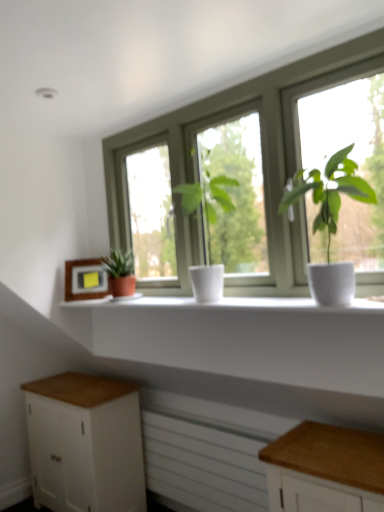
This screenshot has width=384, height=512. Describe the element at coordinates (85, 444) in the screenshot. I see `white wood cabinet at lower left` at that location.

Locate an element on the screen. The image size is (384, 512). white matte plant pot at center, the 3th houseplant from the left is located at coordinates (330, 221).

Image resolution: width=384 pixels, height=512 pixels. Find the location of `green matte plant at left, marked as the third houseplant in a right-to-left arrangement`. green matte plant at left, marked as the third houseplant in a right-to-left arrangement is located at coordinates point(120,273).

Is white matte window sill at center wider than white matte plant pot at center, positioned as the second houseplant in front-to-back order?

Yes.

Between white matte window sill at center and white matte plant pot at center, positioned as the second houseplant in left-to-right order, which one has larger size?

With larger size is white matte plant pot at center, positioned as the second houseplant in left-to-right order.

Which object is positioned more to the left, white matte window sill at center or white matte plant pot at center, positioned as the second houseplant in front-to-back order?

white matte window sill at center is more to the left.

From a real-world perspective, which object rests below the other?

white matte window sill at center is physically lower.

From the image's perspective, is white matte window at center over wooden frame at left?

Yes, from the image's perspective, white matte window at center is on top of wooden frame at left.

Based on the photo, which is less distant, (269, 162) or (89, 291)?

The point (269, 162) is in front.

The width and height of the screenshot is (384, 512). I want to click on picture frame behind the white matte window at center, so click(x=85, y=280).

From the picture: Which of these two, white matte window at center or wooden frame at left, stands shorter?

wooden frame at left is shorter.

Is point (133, 268) behind point (342, 275)?

Yes, point (133, 268) is farther from viewer.

Which is correct: green matte plant at left, which is counted as the third houseplant, starting from the front, is inside white matte plant pot at center, marked as the third houseplant in a back-to-front arrangement, or outside of it?

green matte plant at left, which is counted as the third houseplant, starting from the front, exists outside the volume of white matte plant pot at center, marked as the third houseplant in a back-to-front arrangement.

Based on the photo, are green matte plant at left, which is counted as the third houseplant, starting from the front, and white matte plant pot at center, the 1th houseplant positioned from the right, located far from each other?

Yes.

From the image's perspective, is green matte plant at left, the first houseplant positioned from the left, above or below white matte plant pot at center, which appears as the 1th houseplant when viewed from the front?

green matte plant at left, the first houseplant positioned from the left, is below white matte plant pot at center, which appears as the 1th houseplant when viewed from the front.

Locate an element on the screen. The height and width of the screenshot is (512, 384). the 1st houseplant in front of the white wood cabinet at lower left, starting your count from the anchor is located at coordinates (120, 273).

From a real-world perspective, is green matte plant at left, which is counted as the third houseplant, starting from the front, above or below white wood cabinet at lower left?

Clearly, from a real-world perspective, green matte plant at left, which is counted as the third houseplant, starting from the front, is above white wood cabinet at lower left.

Is white wood cabinet at lower left at the back of green matte plant at left, which is counted as the third houseplant, starting from the front?

No.

How distant is green matte plant at left, which is counted as the third houseplant, starting from the front, from white wood cabinet at lower left?

green matte plant at left, which is counted as the third houseplant, starting from the front, and white wood cabinet at lower left are 87.49 centimeters apart.

Does point (139, 510) lie in front of point (84, 268)?

No, it is behind (84, 268).

Can you confirm if white wood cabinet at lower left is positioned to the right of wooden frame at left?

No.

Image resolution: width=384 pixels, height=512 pixels. I want to click on cabinetry on the left of wooden frame at left, so click(85, 444).

Can you see white wood cabinet at lower left touching wooden frame at left?

No, white wood cabinet at lower left is not making contact with wooden frame at left.

From the image's perspective, which one is positioned higher, white matte plant pot at center, the 3th houseplant from the left, or white matte radiator at lower center?

white matte plant pot at center, the 3th houseplant from the left.

Looking at this image, which of these two, white matte plant pot at center, marked as the third houseplant in a back-to-front arrangement, or white matte radiator at lower center, is bigger?

white matte radiator at lower center is bigger.

Does white matte plant pot at center, marked as the third houseplant in a back-to-front arrangement, turn towards white matte radiator at lower center?

No, white matte plant pot at center, marked as the third houseplant in a back-to-front arrangement, is not oriented towards white matte radiator at lower center.

Between white matte plant pot at center, the 3th houseplant from the left, and white matte radiator at lower center, which one has more height?

With more height is white matte radiator at lower center.

Is white matte window at center facing away from white matte window sill at center?

No, white matte window at center's orientation is not away from white matte window sill at center.

From a real-world perspective, between white matte window at center and white matte window sill at center, who is vertically higher?

In real-world perspective, white matte window at center is above.

From the picture: Can you tell me how much white matte window at center and white matte window sill at center differ in facing direction?

The angle between the facing direction of white matte window at center and the facing direction of white matte window sill at center is 0.137 degrees.

How much distance is there between white matte window at center and white matte window sill at center?

white matte window at center and white matte window sill at center are 17.07 inches apart from each other.

Which houseplant is the 1st one when counting from the back of the white matte window sill at center? Please provide its 2D coordinates.

[(207, 228)]

Find the location of a particular element. picture frame on the left of white matte window at center is located at coordinates (85, 280).

When comparing their distances from white wood cabinet at lower left, does white matte window sill at center or white matte window at center seem closer?

Based on the image, white matte window sill at center appears to be nearer to white wood cabinet at lower left.

Looking at the image, which one is located closer to white matte window at center, white wood cabinet at lower left or white matte window sill at center?

Among the two, white matte window sill at center is located nearer to white matte window at center.

Considering their positions, is white wood cabinet at lower left positioned further to white matte plant pot at center, the 1th houseplant positioned from the right, than green matte plant at left, arranged as the first houseplant when viewed from the back?

white wood cabinet at lower left.

Considering their positions, is white matte plant pot at center, marked as the third houseplant in a back-to-front arrangement, positioned closer to white matte window sill at center than white matte window at center?

white matte plant pot at center, marked as the third houseplant in a back-to-front arrangement.

Consider the image. Considering their positions, is green matte plant at left, marked as the third houseplant in a right-to-left arrangement, positioned further to white matte window at center than white matte radiator at lower center?

white matte radiator at lower center lies further to white matte window at center than the other object.

When comparing their distances from white matte window at center, does white matte plant pot at center, which appears as the 1th houseplant when viewed from the front, or white wood cabinet at lower left seem closer?

white matte plant pot at center, which appears as the 1th houseplant when viewed from the front, lies closer to white matte window at center than the other object.

Considering their positions, is white matte plant pot at center, positioned as the second houseplant in front-to-back order, positioned further to white matte window sill at center than wooden frame at left?

white matte plant pot at center, positioned as the second houseplant in front-to-back order, is positioned further to the anchor white matte window sill at center.

Which object lies nearer to the anchor point white matte window at center, white matte window sill at center or white matte radiator at lower center?

white matte window sill at center is closer to white matte window at center.

What are the coordinates of `window sill that lies between white matte plant pot at center, the second houseplant from the right, and white matte radiator at lower center from top to bottom` in the screenshot? It's located at (223, 304).

Image resolution: width=384 pixels, height=512 pixels. I want to click on houseplant between white matte plant pot at center, marked as the third houseplant in a back-to-front arrangement, and white wood cabinet at lower left, in the vertical direction, so click(120, 273).

The image size is (384, 512). I want to click on houseplant between white matte plant pot at center, which appears as the 1th houseplant when viewed from the front, and white matte radiator at lower center from top to bottom, so click(x=120, y=273).

In order to click on picture frame between green matte plant at left, which is counted as the third houseplant, starting from the front, and white wood cabinet at lower left in the up-down direction in this screenshot , I will do `click(85, 280)`.